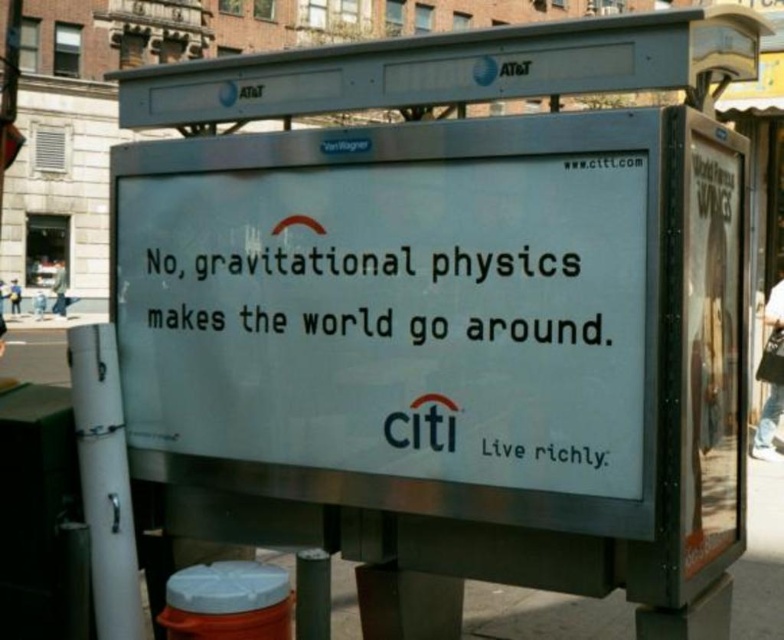
Question: Does black text at center appear over gray concrete pavement at lower center?

Choices:
 (A) no
 (B) yes

Answer: (B)

Question: Can you confirm if metallic silver street sign at upper center is thinner than gray concrete pavement at lower center?

Choices:
 (A) yes
 (B) no

Answer: (A)

Question: Which of the following is the farthest from the observer?

Choices:
 (A) (612, 627)
 (B) (532, 40)
 (C) (253, 307)

Answer: (A)

Question: Does black text at center come behind gray concrete pavement at lower center?

Choices:
 (A) no
 (B) yes

Answer: (A)

Question: Which point is farther to the camera?

Choices:
 (A) gray concrete pavement at lower center
 (B) black text at center
 (C) metallic silver street sign at upper center

Answer: (A)

Question: Which point is farther to the camera?

Choices:
 (A) (597, 339)
 (B) (518, 72)

Answer: (B)